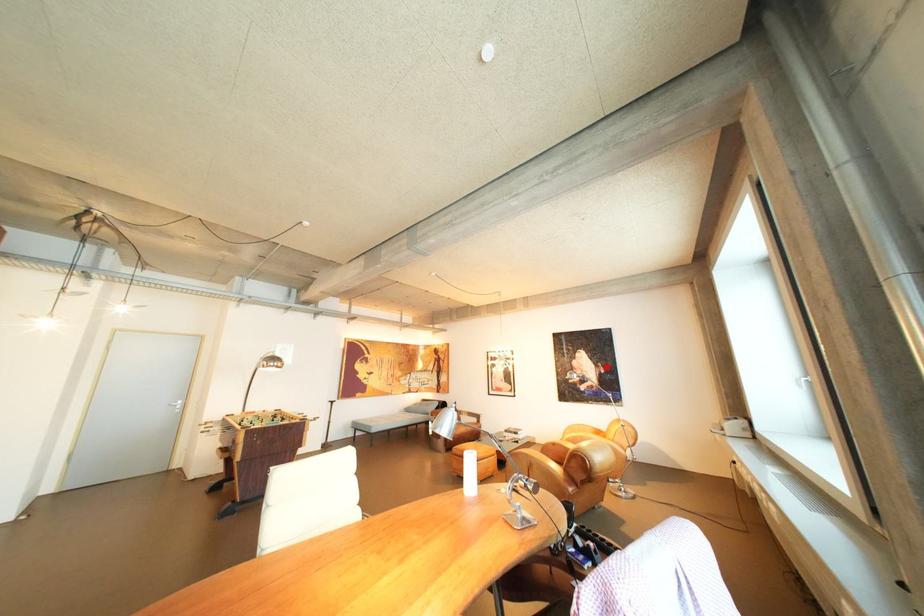
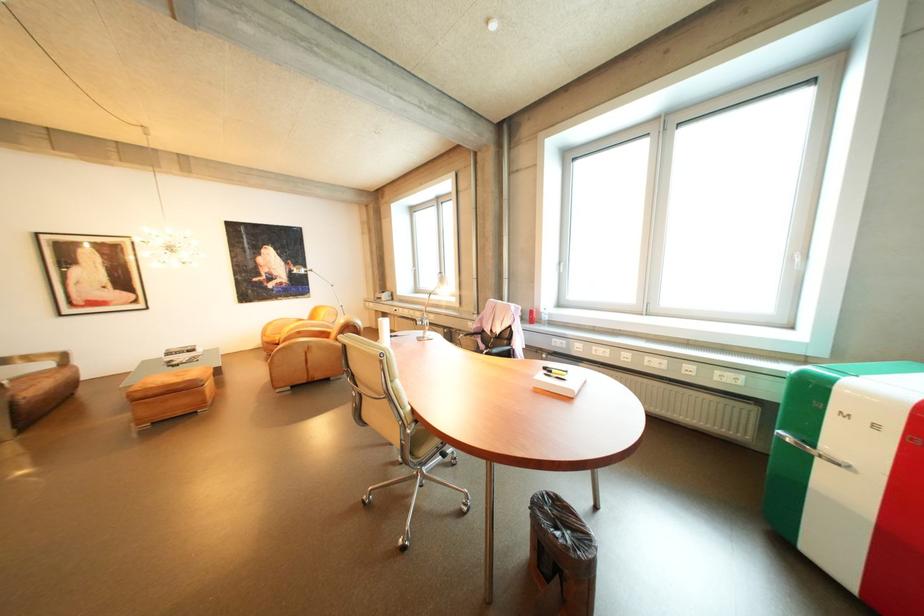
Question: I am providing you with two images of the same scene from different viewpoints. Given a red point in image1, look at the same physical point in image2. Is it:

Choices:
 (A) Closer to the viewpoint
 (B) Farther from the viewpoint

Answer: (A)